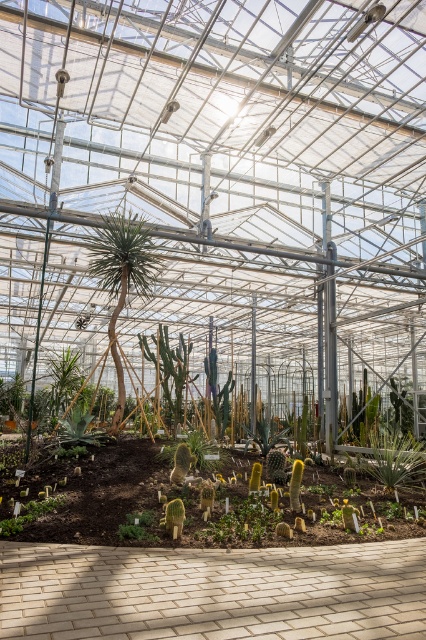
Question: Does green leafy plant at center appear over green matte cactus at lower left?

Choices:
 (A) no
 (B) yes

Answer: (A)

Question: Which point is closer to the camera taking this photo?

Choices:
 (A) (403, 442)
 (B) (51, 508)

Answer: (B)

Question: Which object appears farthest from the camera in this image?

Choices:
 (A) green matte cactus at lower left
 (B) green leafy plant at center

Answer: (B)

Question: In this image, where is green leafy plant at center located relative to green matte cactus at lower left?

Choices:
 (A) right
 (B) left

Answer: (A)

Question: Which point is farther from the camera taking this photo?

Choices:
 (A) (2, 531)
 (B) (402, 480)

Answer: (B)

Question: Observing the image, what is the correct spatial positioning of green leafy plant at center in reference to green matte cactus at lower left?

Choices:
 (A) left
 (B) right

Answer: (B)